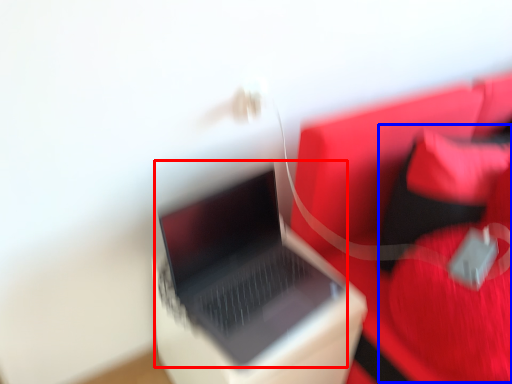
Question: Which point is further to the camera, laptop (highlighted by a red box) or bean bag chair (highlighted by a blue box)?

Choices:
 (A) laptop
 (B) bean bag chair

Answer: (A)